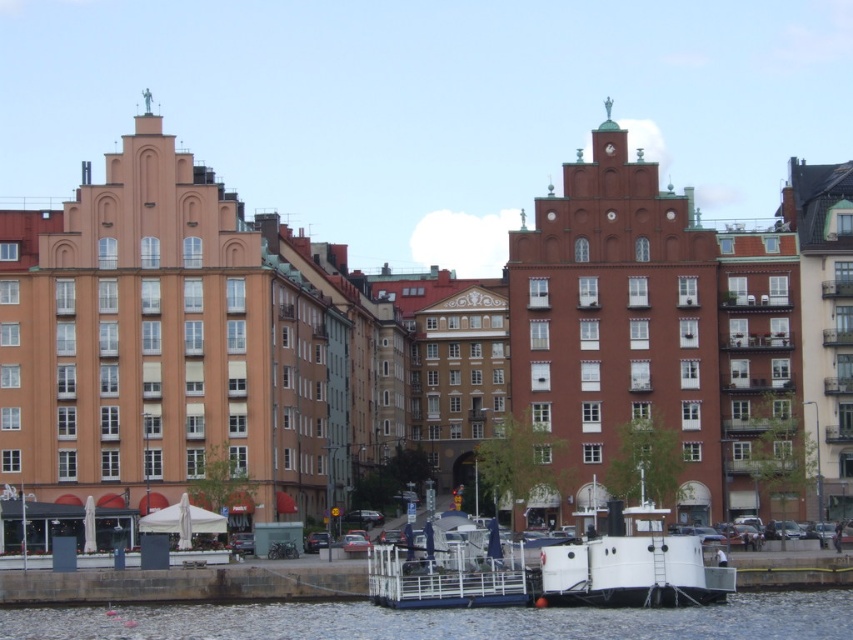
You are standing at the point marked by the coordinates point (444, 620) in the waterfront scene. Describe what you see around you.

At point (444, 620), you are surrounded by white glossy water at lower center, which is the location marked by the coordinates.

You are standing on the dock and see the white glossy water at lower center and the white matte boat at lower center. Which object is positioned to the right side of the other?

The white glossy water at lower center is to the right of the white matte boat at lower center.

You are a photographer planning to capture the waterfront scene. You notice the white glossy water at lower center and the white matte boat at lower center. Based on their positions, which one is more likely to reflect the historic buildings in the background?

The white glossy water at lower center is more likely to reflect the historic buildings in the background because it is wider than the white matte boat at lower center, providing a larger surface area for reflections.